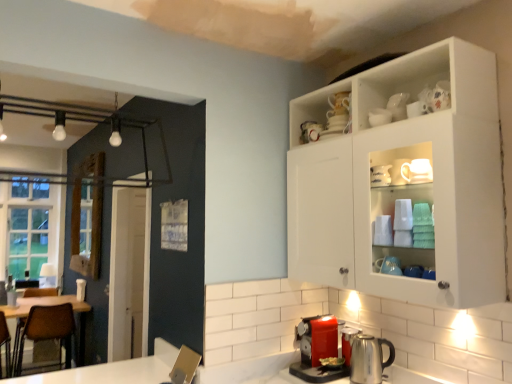
Question: Is white glossy mug at upper center, arranged as the 1th tableware when viewed from the top, inside brown leather chair at left?

Choices:
 (A) yes
 (B) no

Answer: (B)

Question: Is brown leather chair at left turned away from white glossy mug at upper center, acting as the 2th tableware starting from the front?

Choices:
 (A) no
 (B) yes

Answer: (A)

Question: Is brown leather chair at left shorter than white glossy mug at upper center, acting as the 2th tableware starting from the front?

Choices:
 (A) yes
 (B) no

Answer: (B)

Question: Is the depth of brown leather chair at left less than that of white glossy mug at upper center, which is counted as the 1th tableware, starting from the back?

Choices:
 (A) yes
 (B) no

Answer: (B)

Question: From a real-world perspective, is brown leather chair at left below white glossy mug at upper center, arranged as the 2th tableware when viewed from the left?

Choices:
 (A) no
 (B) yes

Answer: (B)

Question: From the image's perspective, would you say brown leather chair at left is shown under white glossy mug at upper center, arranged as the 2th tableware when viewed from the left?

Choices:
 (A) yes
 (B) no

Answer: (A)

Question: Can you confirm if white ceramic mug at upper center, the second tableware positioned from the top, is thinner than white glossy cabinet at upper right?

Choices:
 (A) no
 (B) yes

Answer: (B)

Question: Considering the relative sizes of white ceramic mug at upper center, the 1th tableware from the left, and white glossy cabinet at upper right in the image provided, is white ceramic mug at upper center, the 1th tableware from the left, bigger than white glossy cabinet at upper right?

Choices:
 (A) no
 (B) yes

Answer: (A)

Question: Can you confirm if white ceramic mug at upper center, marked as the 1th tableware in a bottom-to-top arrangement, is taller than white glossy cabinet at upper right?

Choices:
 (A) no
 (B) yes

Answer: (A)

Question: Is white glossy cabinet at upper right at the back of white ceramic mug at upper center, which ranks as the 2th tableware in back-to-front order?

Choices:
 (A) no
 (B) yes

Answer: (B)

Question: From the image's perspective, is white ceramic mug at upper center, marked as the 1th tableware in a bottom-to-top arrangement, located beneath white glossy cabinet at upper right?

Choices:
 (A) yes
 (B) no

Answer: (B)

Question: Considering the relative positions of white ceramic mug at upper center, the 1th tableware when ordered from front to back, and white glossy cabinet at upper right in the image provided, is white ceramic mug at upper center, the 1th tableware when ordered from front to back, behind white glossy cabinet at upper right?

Choices:
 (A) yes
 (B) no

Answer: (A)

Question: Does white glossy cabinet at upper right come behind white ceramic mug at upper center, the 1th tableware when ordered from front to back?

Choices:
 (A) no
 (B) yes

Answer: (A)